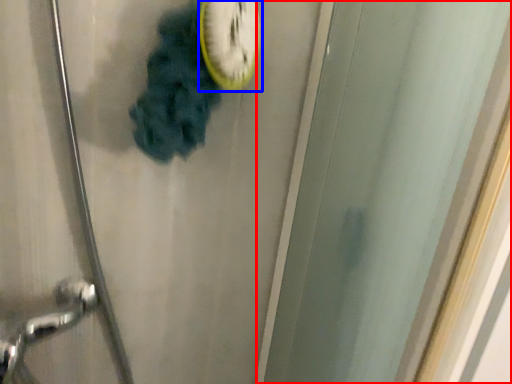
Question: Which of the following is the farthest to the observer, screen door (highlighted by a red box) or clock (highlighted by a blue box)?

Choices:
 (A) screen door
 (B) clock

Answer: (B)